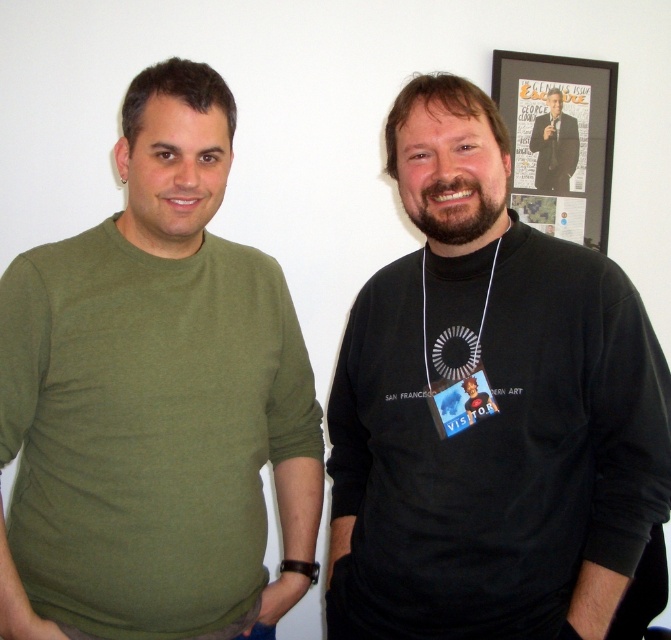
Question: Is black matte t-shirt at center above matte black suit at upper center?

Choices:
 (A) no
 (B) yes

Answer: (A)

Question: Which object appears farthest from the camera in this image?

Choices:
 (A) black matte t-shirt at center
 (B) olive green t-shirt at left
 (C) black framed poster at upper right

Answer: (C)

Question: Observing the image, what is the correct spatial positioning of black framed poster at upper right in reference to matte black suit at upper center?

Choices:
 (A) left
 (B) right

Answer: (B)

Question: Which point appears farthest from the camera in this image?

Choices:
 (A) (146, 376)
 (B) (431, 426)
 (C) (584, 76)
 (D) (550, 100)

Answer: (C)

Question: Which of the following is the farthest from the observer?

Choices:
 (A) (550, 109)
 (B) (582, 128)
 (C) (197, 404)
 (D) (450, 387)

Answer: (B)

Question: In this image, where is black matte t-shirt at center located relative to olive green t-shirt at left?

Choices:
 (A) left
 (B) right

Answer: (B)